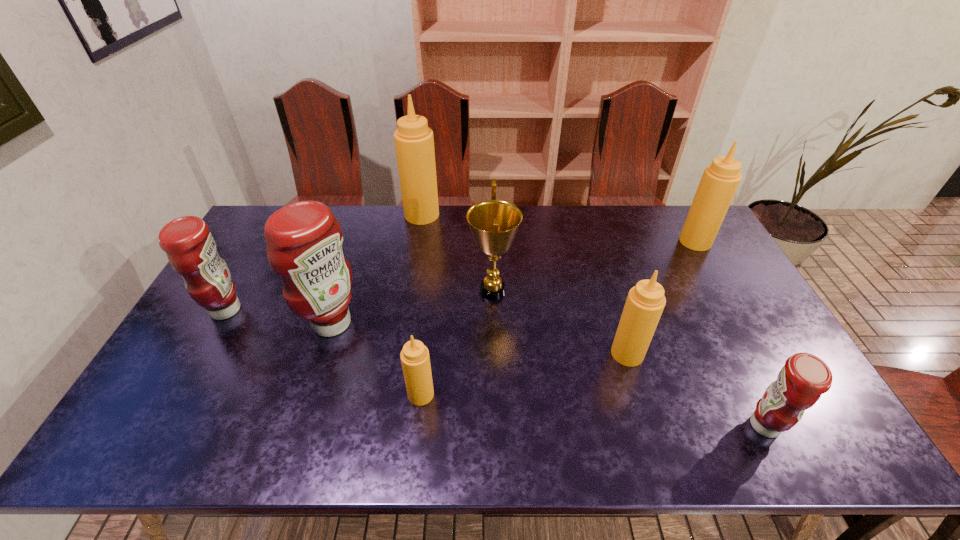
Find the location of a particular element. empty space that is in between the tallest object and the third tan condiment from left to right is located at coordinates (524, 284).

Find the location of a particular element. The image size is (960, 540). free space between the smallest tan condiment and the tallest object is located at coordinates 421,305.

Where is `object that stands as the seventh closest to the second smallest tan condiment`? This screenshot has width=960, height=540. object that stands as the seventh closest to the second smallest tan condiment is located at coordinates (191, 249).

The image size is (960, 540). I want to click on the seventh closest object to the third nearest tan condiment, so click(x=191, y=249).

Select which condiment is the fourth closest to the smallest tan condiment. Please provide its 2D coordinates. Your answer should be formatted as a tuple, i.e. [(x, y)], where the tuple contains the x and y coordinates of a point satisfying the conditions above.

[(414, 143)]

What are the coordinates of `condiment that is the fourth nearest to the second smallest red condiment` in the screenshot? It's located at (645, 302).

Where is `tan condiment object that ranks as the closest to the leftmost object`? The width and height of the screenshot is (960, 540). tan condiment object that ranks as the closest to the leftmost object is located at coordinates [x=414, y=143].

Where is `tan condiment that is the third closest to the third tan condiment from left to right`? The image size is (960, 540). tan condiment that is the third closest to the third tan condiment from left to right is located at coordinates (414, 143).

Locate which red condiment is the second closest to the smallest tan condiment. Please provide its 2D coordinates. Your answer should be formatted as a tuple, i.e. [(x, y)], where the tuple contains the x and y coordinates of a point satisfying the conditions above.

[(191, 249)]

Where is `the closest red condiment to the nearest tan condiment`? The width and height of the screenshot is (960, 540). the closest red condiment to the nearest tan condiment is located at coordinates (304, 240).